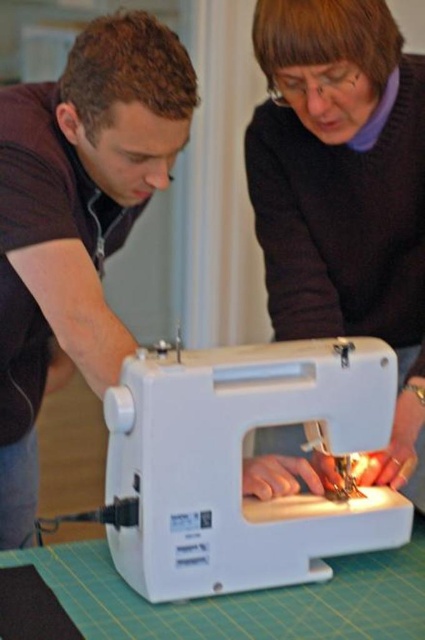
You are standing at the origin point of the coordinate system in the image. The white plastic sewing machine at center is at point (240, 465). If you want to move towards the white plastic sewing machine at center, in which direction should you move?

To move towards the white plastic sewing machine at center located at point (240, 465) from the origin, you should move in the positive x and positive y direction since the coordinates are both greater than zero.

You are a sewing instructor and need to locate the sewing machine in the image. Which object label from the list corresponds to the coordinates point (76, 220)?

The point (76, 220) corresponds to the matte black sewing machine at left.

You are a sewing instructor observing the scene. You need to place a 10cm tall pattern template between the white plastic sewing machine at center and the green cutting mat at lower center. Which object should the template be placed closer to, and why?

The pattern template should be placed closer to the green cutting mat at lower center because the white plastic sewing machine at center is much taller than the green cutting mat at lower center, so the template needs to be positioned where there is enough vertical space to accommodate its height without obstruction.